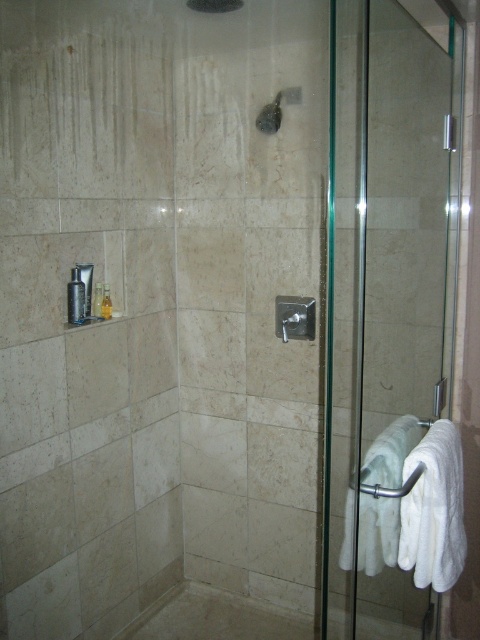
You are standing in the shower area and want to reach a point marked as point (x=340, y=506). If your arm can extend 1.8 meters, will you be able to reach it?

The distance between you and point (x=340, y=506) is 1.93 meters, which is slightly longer than your arm can reach. Therefore, you cannot reach it with your arm extended to 1.8 meters.

You are standing in the shower area and want to exit through the transparent glass door at right. Based on the coordinates provided, in which direction should you move relative to your current position to reach the door?

The transparent glass door at right is located at coordinates approximately 0.467 on the x axis and 0.798 on the y axis. To reach it, you should move towards the right side of the shower area since the door is positioned at the right side as indicated by its coordinates.

You are standing in the shower area and need to reach both the point at coordinates point [241,598] and the point at coordinates point [279,116]. Which point is closer to you?

Point [241,598] is further to the viewer than point [279,116], so the point at coordinates point [279,116] is closer to you.